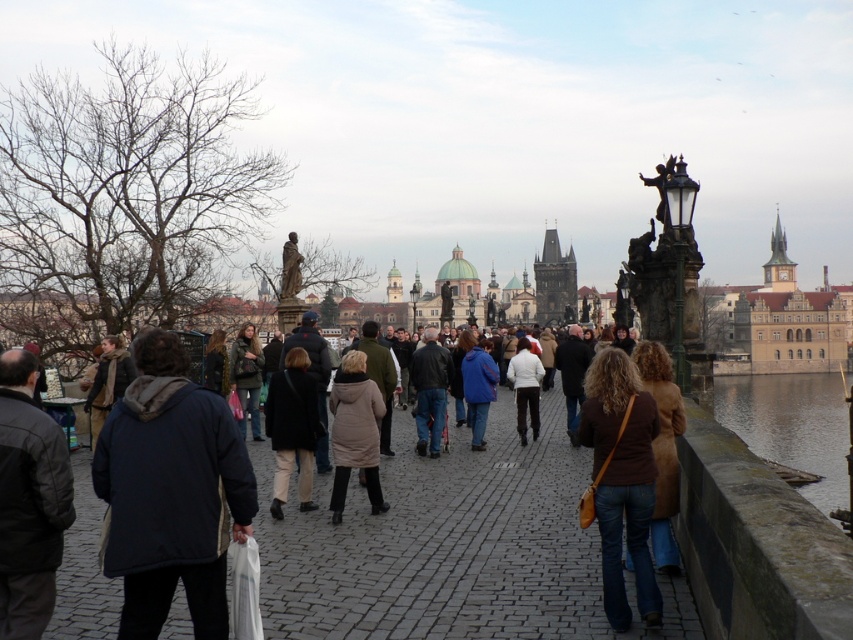
You are standing on the cobblestone bridge and want to locate the smooth concrete wall at lower right. According to the coordinates provided, where would you find it?

The smooth concrete wall at lower right is located at coordinates point (792,426).

You are a delivery person carrying a large box that is 1 meter wide. You need to walk across the bridge shown in the image. Can you pass through the area between the dark gray cobblestone at center and the brown fuzzy coat at right without the box hitting anything?

The dark gray cobblestone at center has a larger width than the brown fuzzy coat at right. Since the box is 1 meter wide, you need to ensure there is enough space between them. However, the exact distance between the two objects isn not provided, so it is uncertain if the box will fit. Check the actual space before proceeding.